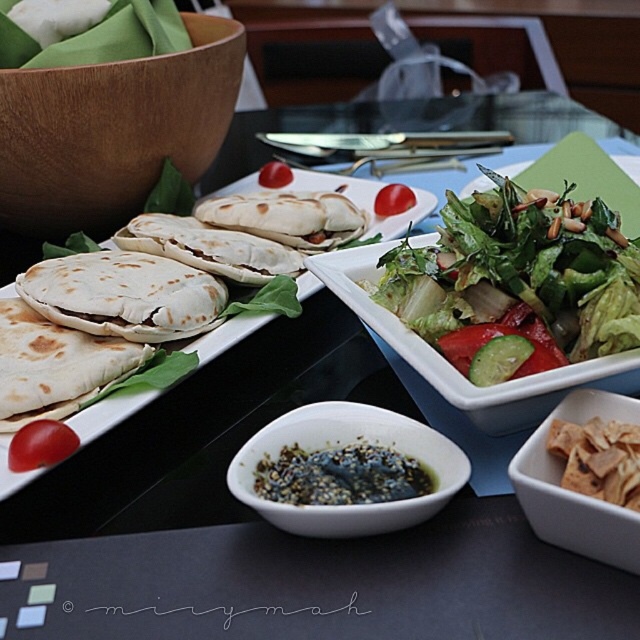
You are a guest at a dinner table and want to reach for the wooden bowl at upper left. Considering the table setup described, where should you look relative to the two plates to find it?

The wooden bowl at upper left is located at point (113, 129), which is to the upper left of the two plates. Since the plates are placed side by side at the center, the wooden bowl is positioned above and to the left of them.

You are a food delivery person who needs to place a hot dish on the table without touching the existing items. The dish is 5 inches in diameter. Is there enough space between the white soft pita bread at left and the white soft tortilla at center to place it?

The distance between the white soft pita bread at left and the white soft tortilla at center is 4.23 inches. Since the dish is 5 inches in diameter, it would not fit in the space between them.